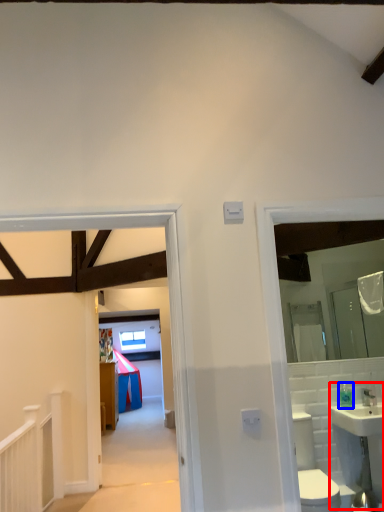
Question: Which of the following is the closest to the observer, sink (highlighted by a red box) or toiletry (highlighted by a blue box)?

Choices:
 (A) sink
 (B) toiletry

Answer: (A)